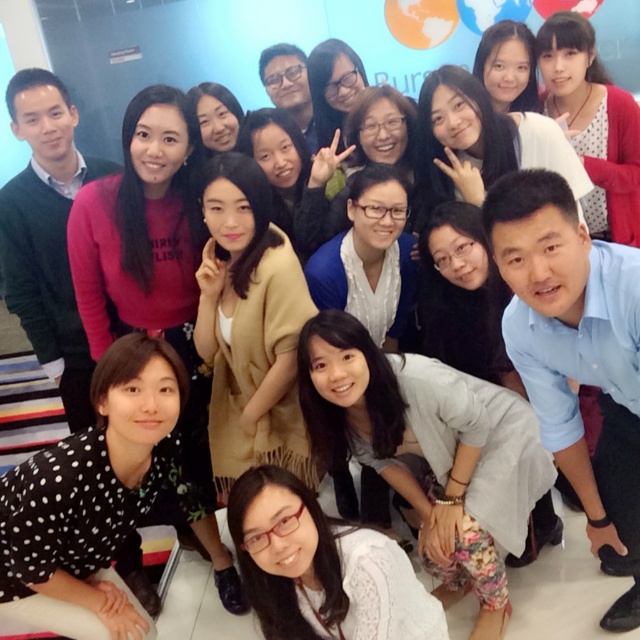
You are organizing a clothing donation drive and need to determine which of the two shirts, the gray fabric shirt at lower center or the blue shirt at lower right, can fit into a standard donation box that requires items to be folded into a 12x12 inch square. Based on their sizes, which shirt is more likely to fit within this requirement?

The blue shirt at lower right is more likely to fit into the 12x12 inch donation box since its width is smaller than the gray fabric shirt at lower center.

You are organizing a photo shoot and need to arrange the gray fabric shirt at lower center and the sweater at left in a row. Based on their widths, which one should you place first if you want the wider item to be on the left side of the row?

The gray fabric shirt at lower center might be wider than sweater at left, so you should place the gray fabric shirt at lower center first on the left side of the row.